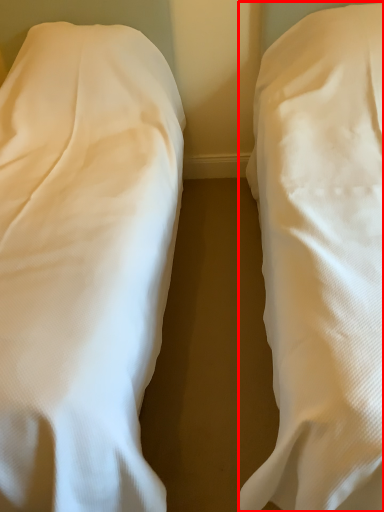
Question: From the image's perspective, where is bed (annotated by the red box) located relative to bed?

Choices:
 (A) below
 (B) above

Answer: (B)